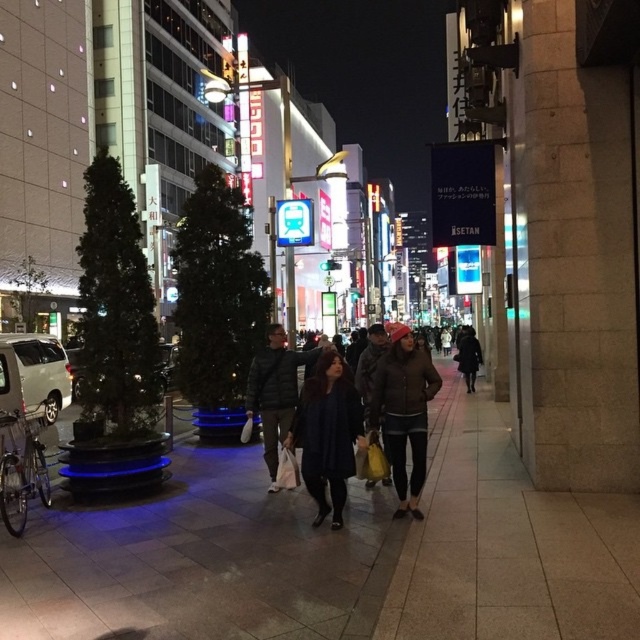
Question: Can you confirm if dark green puffer jacket at center is positioned to the right of dark gray coat at center?

Choices:
 (A) no
 (B) yes

Answer: (A)

Question: Is matte brown jacket at center in front of dark gray coat at center?

Choices:
 (A) yes
 (B) no

Answer: (A)

Question: Which point is farther to the camera?

Choices:
 (A) slate gray pavement at center
 (B) dark blue fabric coat at center

Answer: (B)

Question: Does matte brown jacket at center have a larger size compared to dark green puffer jacket at center?

Choices:
 (A) no
 (B) yes

Answer: (B)

Question: Which point is closer to the camera?

Choices:
 (A) (284, 433)
 (B) (192, 545)
 (C) (461, 355)
 (D) (352, 424)

Answer: (B)

Question: Which object is positioned closest to the dark blue fabric coat at center?

Choices:
 (A) matte brown jacket at center
 (B) dark gray coat at center

Answer: (A)